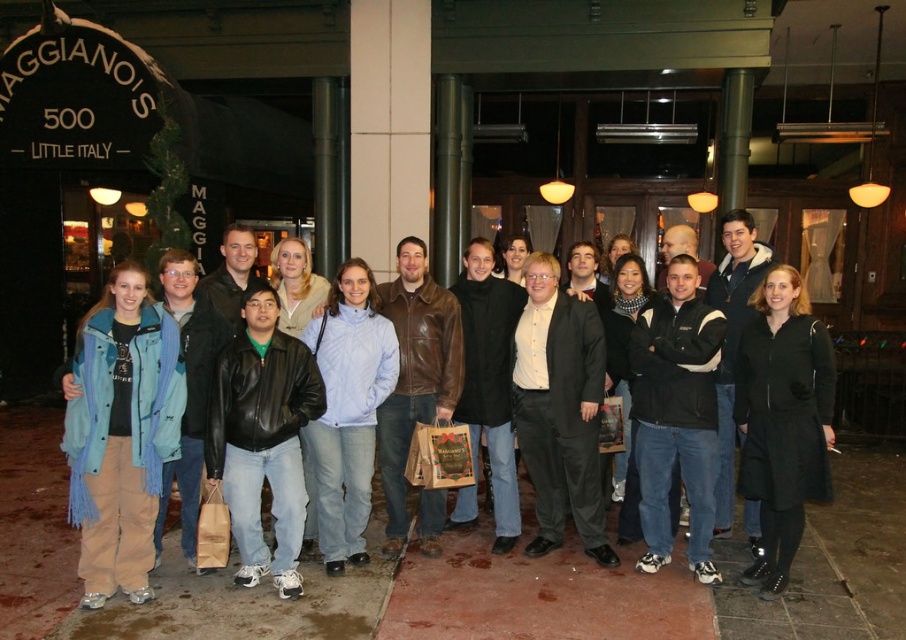
What do you see at coordinates (783, 420) in the screenshot? Image resolution: width=906 pixels, height=640 pixels. I see `black matte coat at center` at bounding box center [783, 420].

Which is above, black matte coat at center or light blue fleece jacket at center?

Positioned higher is black matte coat at center.

At what (x,y) coordinates should I click in order to perform the action: click on black matte coat at center. Please return your answer as a coordinate pair (x, y). This screenshot has width=906, height=640. Looking at the image, I should click on (783, 420).